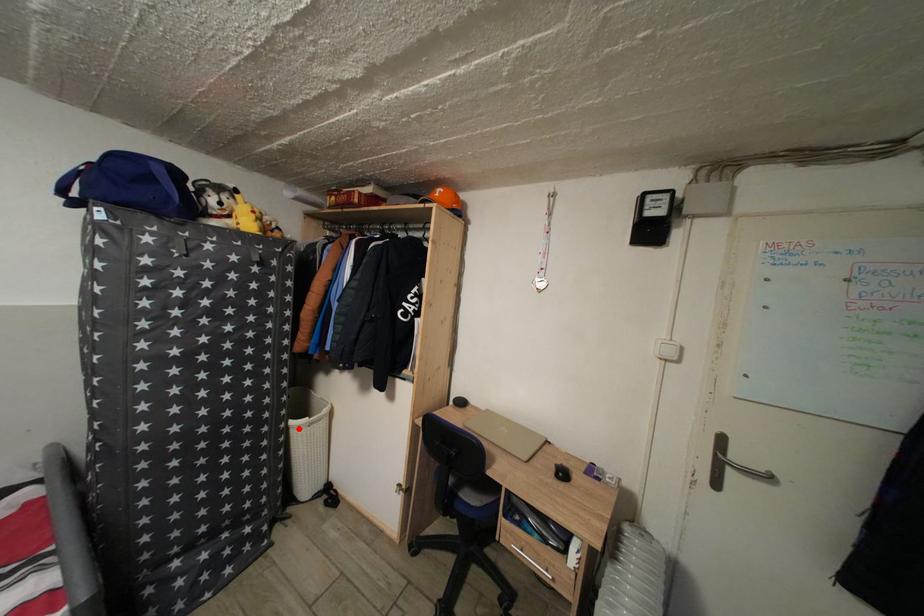
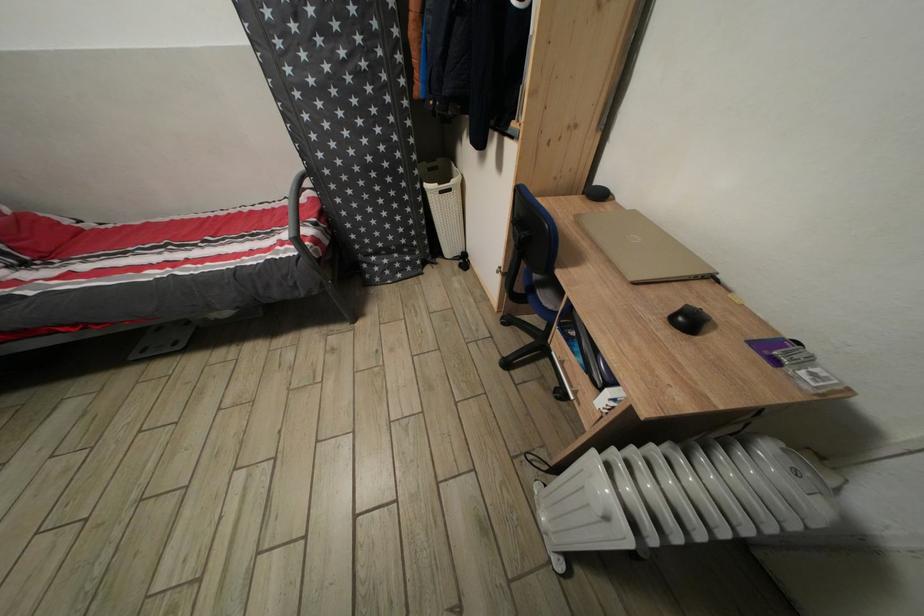
Question: I am providing you with two images of the same scene from different viewpoints. Given a red point in image1, look at the same physical point in image2. Is it:

Choices:
 (A) Closer to the viewpoint
 (B) Farther from the viewpoint

Answer: (A)